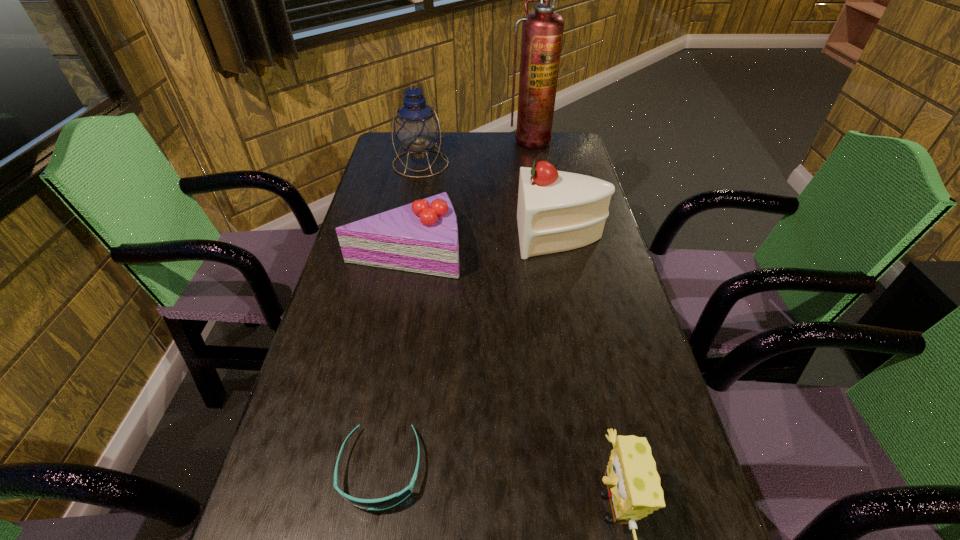
Identify the location of vacant space at the left edge of the desktop. pos(370,357).

What are the coordinates of `blank area at the right edge` in the screenshot? It's located at (612, 413).

In the image, there is a desktop. At what (x,y) coordinates should I click in order to perform the action: click on vacant space at the far right corner. Please return your answer as a coordinate pair (x, y). Looking at the image, I should click on (584, 158).

Where is `free space between the right cake and the left cake`? free space between the right cake and the left cake is located at coordinates (483, 244).

Where is `free space that is in between the third tallest object and the lantern`? free space that is in between the third tallest object and the lantern is located at coordinates (491, 200).

You are a GUI agent. You are given a task and a screenshot of the screen. Output one action in this format:
    pyautogui.click(x=<x>, y=<y>)
    Task: Click on the free space between the tallest object and the lantern
    The height and width of the screenshot is (540, 960).
    Given the screenshot: What is the action you would take?
    pyautogui.click(x=475, y=152)

Find the location of `empty space that is in between the sunglasses and the lantern`. empty space that is in between the sunglasses and the lantern is located at coordinates [x=400, y=316].

Locate an element on the screen. blank region between the left cake and the right cake is located at coordinates (483, 244).

This screenshot has height=540, width=960. Find the location of `empty space that is in between the shortest object and the shorter cake`. empty space that is in between the shortest object and the shorter cake is located at coordinates (393, 360).

Point out which object is positioned as the fourth nearest to the sunglasses. Please provide its 2D coordinates. Your answer should be formatted as a tuple, i.e. [(x, y)], where the tuple contains the x and y coordinates of a point satisfying the conditions above.

[(417, 128)]